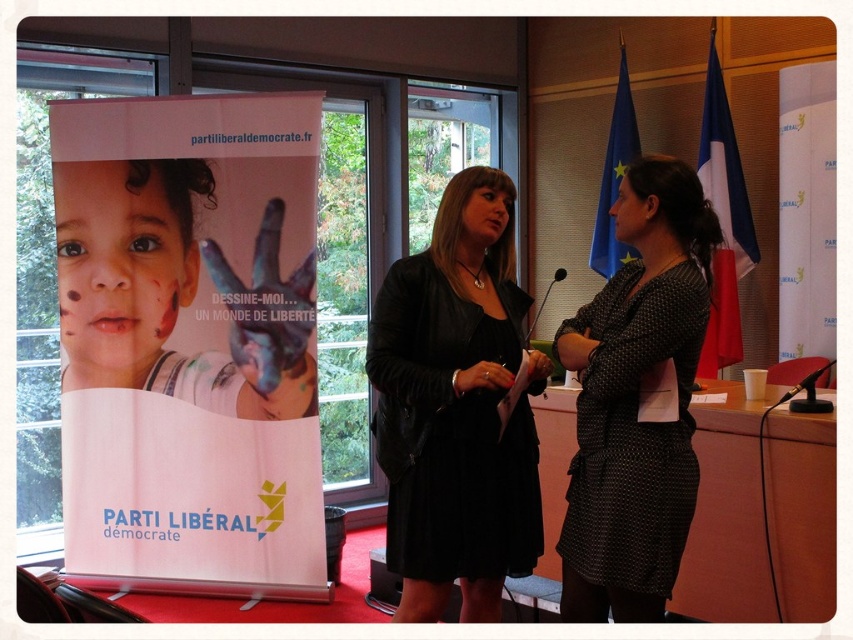
Question: Is black leather dress at center behind blue fabric flag at upper right?

Choices:
 (A) no
 (B) yes

Answer: (A)

Question: Can you confirm if white paper poster at left is thinner than polka dot dress at center?

Choices:
 (A) yes
 (B) no

Answer: (B)

Question: Can you confirm if black leather dress at center is positioned below blue fabric flag at right?

Choices:
 (A) no
 (B) yes

Answer: (B)

Question: Which of the following is the closest to the observer?

Choices:
 (A) blue fabric flag at right
 (B) black leather dress at center

Answer: (B)

Question: Which of the following is the farthest from the observer?

Choices:
 (A) (677, 342)
 (B) (450, 499)
 (C) (709, 154)
 (D) (120, 508)

Answer: (C)

Question: Which point is farther to the camera?

Choices:
 (A) blue fabric flag at right
 (B) blue fabric flag at upper right
 (C) white paper poster at left

Answer: (B)